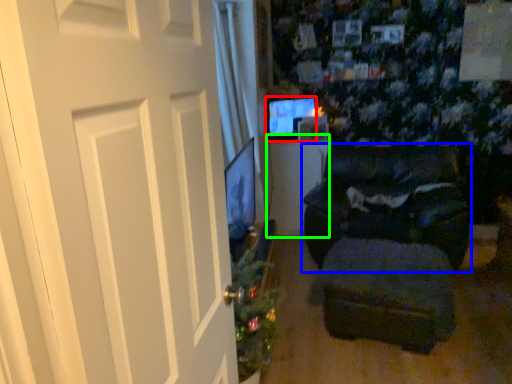
Question: Considering the real-world distances, which object is closest to computer monitor (highlighted by a red box)? furniture (highlighted by a blue box) or table (highlighted by a green box).

Choices:
 (A) furniture
 (B) table

Answer: (B)